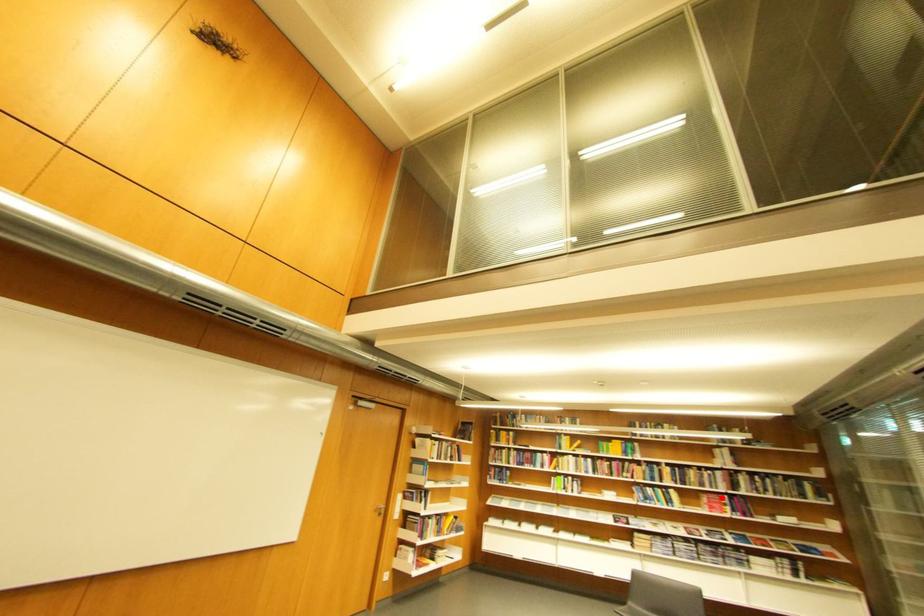
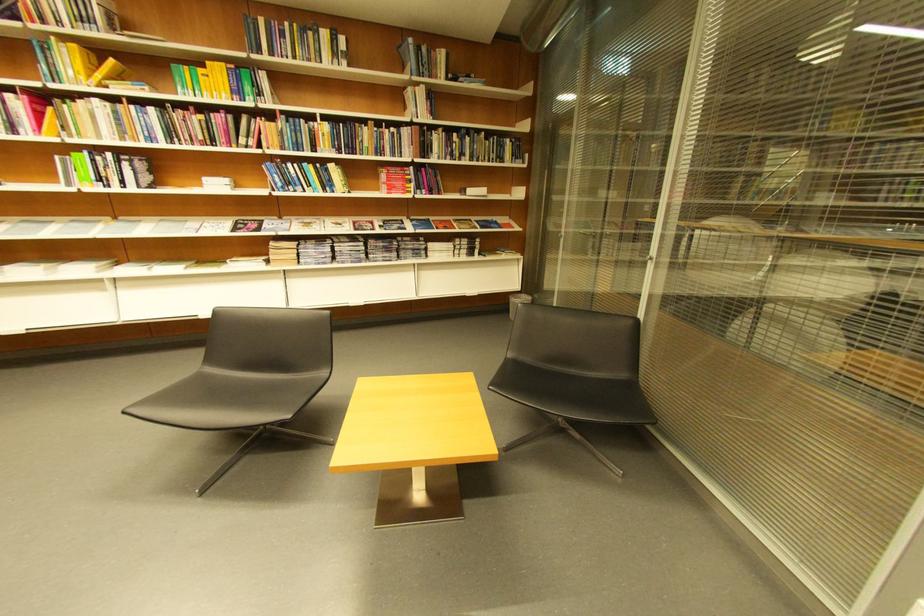
The point at the highlighted location is marked in the first image. Where is the corresponding point in the second image?

(403, 172)